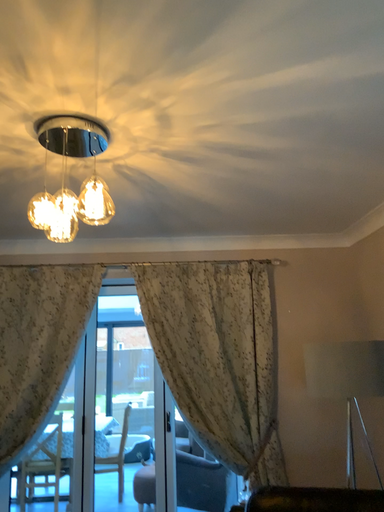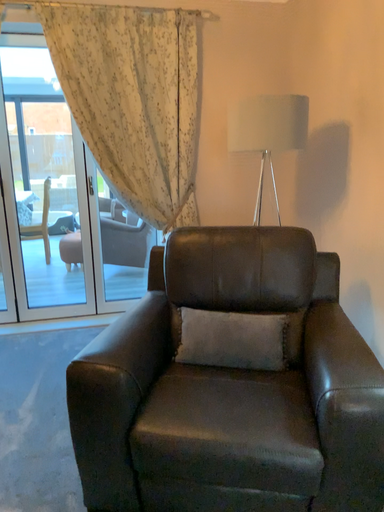
Question: Which way did the camera rotate in the video?

Choices:
 (A) rotated downward
 (B) rotated upward

Answer: (A)